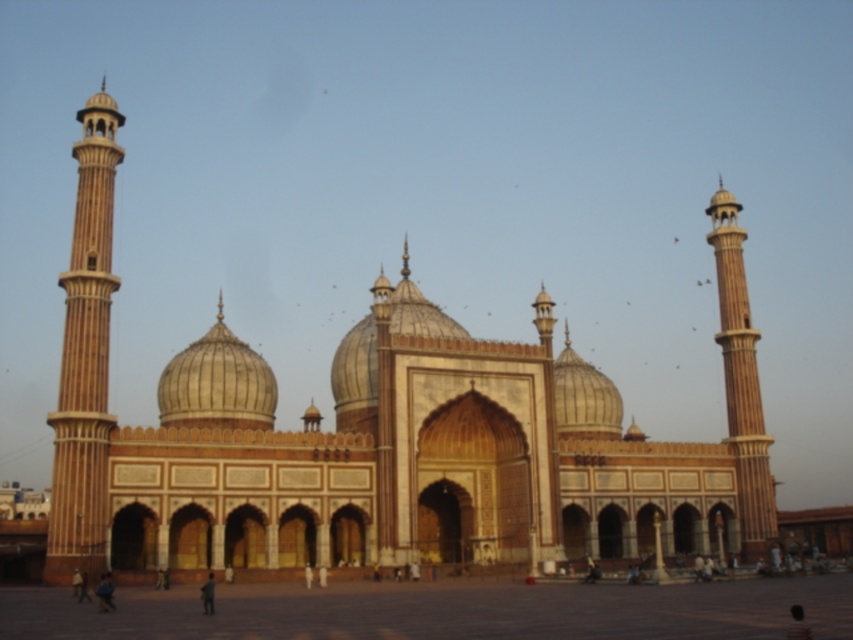
Question: Is brown stone mosque at center below golden textured dome at center?

Choices:
 (A) yes
 (B) no

Answer: (B)

Question: Observing the image, what is the correct spatial positioning of brown stone mosque at center in reference to smooth beige tower at left?

Choices:
 (A) right
 (B) left

Answer: (A)

Question: Which object appears farthest from the camera in this image?

Choices:
 (A) smooth beige tower at right
 (B) smooth beige tower at left

Answer: (A)

Question: Which point appears closest to the camera in this image?

Choices:
 (A) (74, 284)
 (B) (61, 541)
 (C) (718, 291)

Answer: (B)

Question: Which of these objects is positioned closest to the smooth beige tower at right?

Choices:
 (A) brown stone mosque at center
 (B) smooth beige tower at left

Answer: (A)

Question: Can you confirm if smooth beige tower at left is positioned to the left of golden textured dome at center?

Choices:
 (A) yes
 (B) no

Answer: (A)